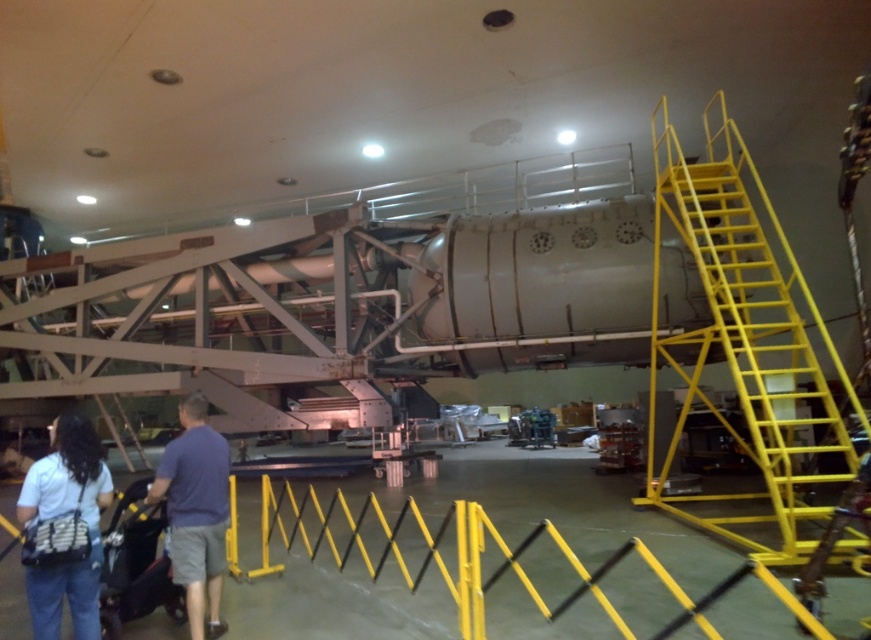
Is yellow metallic staircase at right further to camera compared to white fabric shirt at lower left?

Yes, it is.

Where is `yellow metallic staircase at right`? The image size is (871, 640). yellow metallic staircase at right is located at coordinates (747, 339).

The width and height of the screenshot is (871, 640). Find the location of `yellow metallic staircase at right`. yellow metallic staircase at right is located at coordinates pyautogui.click(x=747, y=339).

Does white fabric shirt at lower left have a larger size compared to blue cotton shirt at lower left?

Incorrect, white fabric shirt at lower left is not larger than blue cotton shirt at lower left.

Is white fabric shirt at lower left to the right of blue cotton shirt at lower left from the viewer's perspective?

In fact, white fabric shirt at lower left is to the left of blue cotton shirt at lower left.

Is point (53, 449) closer to viewer compared to point (181, 493)?

No, it is not.

Locate an element on the screen. The height and width of the screenshot is (640, 871). white fabric shirt at lower left is located at coordinates (63, 513).

Between point (487, 538) and point (217, 586), which one is positioned in front?

Point (217, 586) is more forward.

Which is behind, point (309, 500) or point (193, 548)?

The point (309, 500) is more distant.

Measure the distance between point (475, 532) and camera.

10.95 feet

Image resolution: width=871 pixels, height=640 pixels. I want to click on yellow metal barrier at lower center, so click(x=468, y=556).